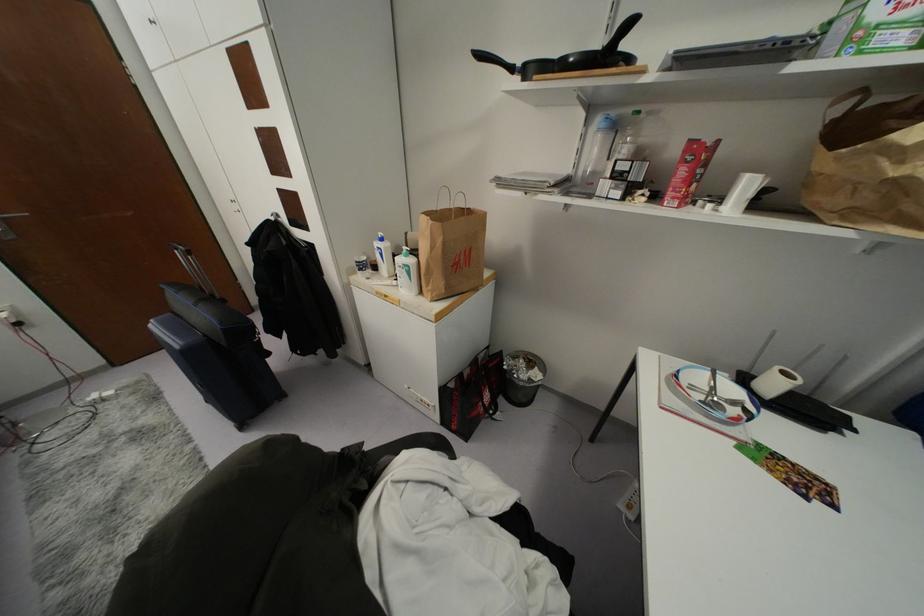
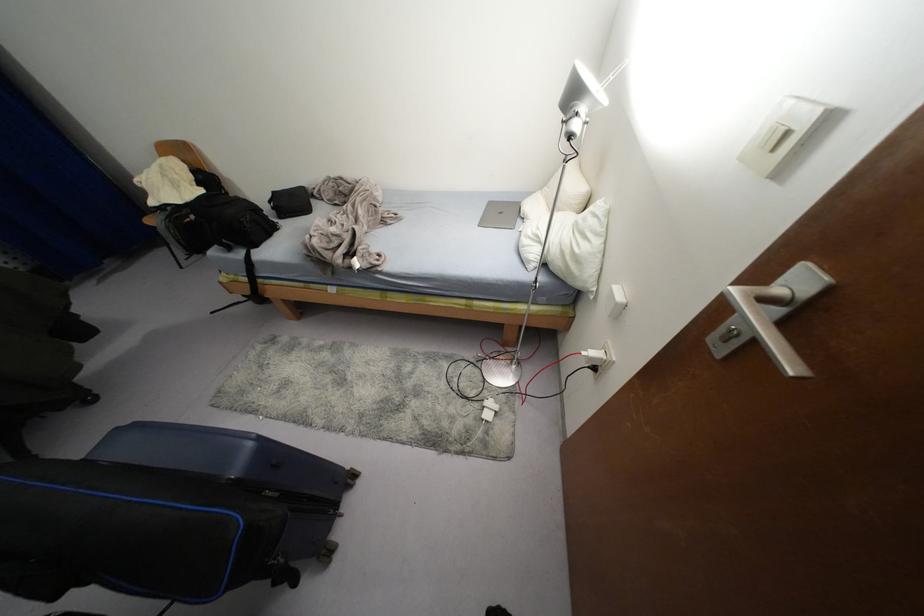
The point at (108,392) is marked in the first image. Where is the corresponding point in the second image?

(487, 416)